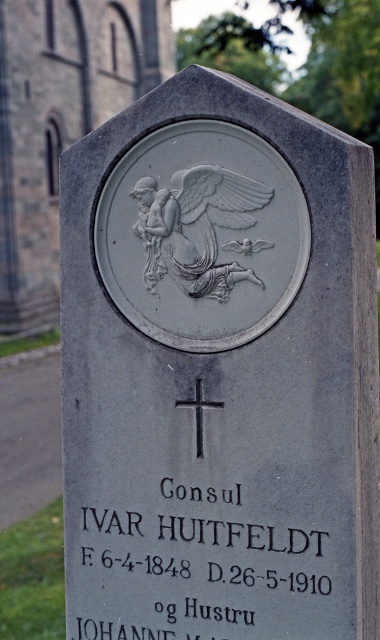
You are a historian examining the gravestone and notice the black stone text at center and the white glossy eagle at center. Which object is taller?

The black stone text at center is much taller than the white glossy eagle at center.

You are standing in front of the gravestone and want to place a small bouquet of flowers exactly at point [231,192]. If you are currently 3 meters away from the gravestone, are you far enough to toss the bouquet to that point?

The distance between point [231,192] and the viewer is 2.74 meters. Since you are 3 meters away from the gravestone, you are far enough to toss the bouquet to that point.